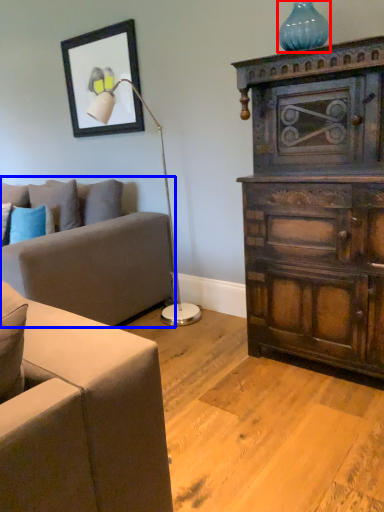
Question: Which object appears closest to the camera in this image, vase (highlighted by a red box) or studio couch (highlighted by a blue box)?

Choices:
 (A) vase
 (B) studio couch

Answer: (B)